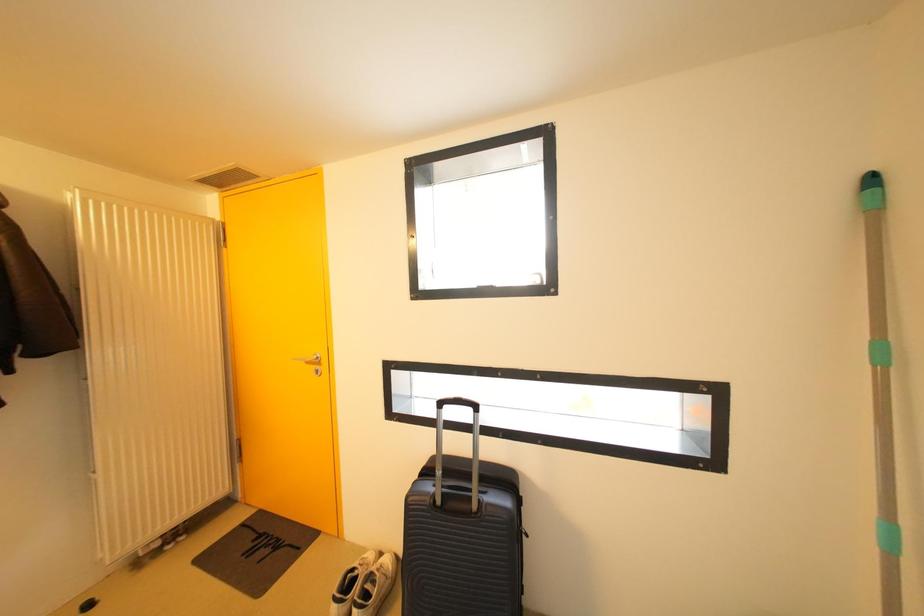
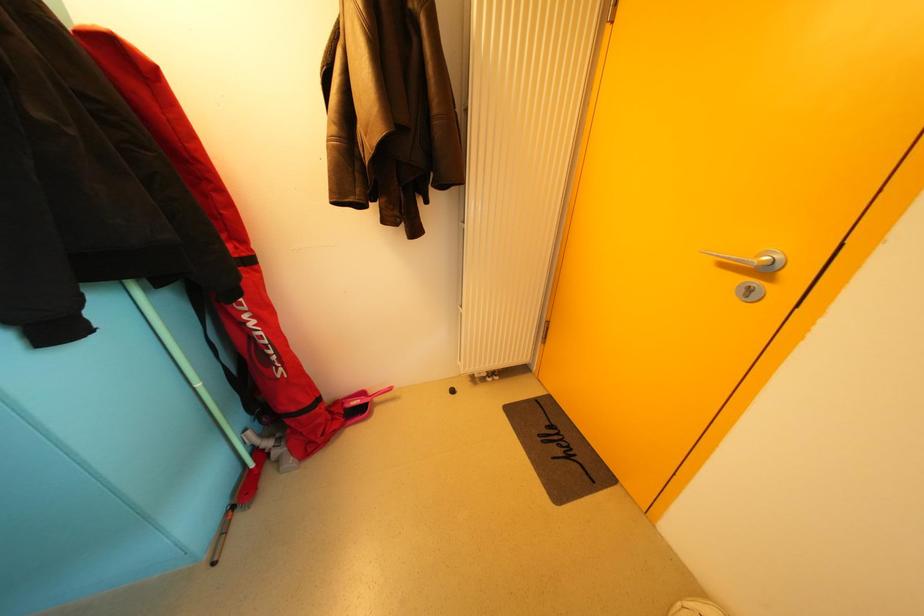
The images are taken continuously from a first-person perspective. In which direction is your viewpoint rotating?

The rotation direction of the camera is left-down.